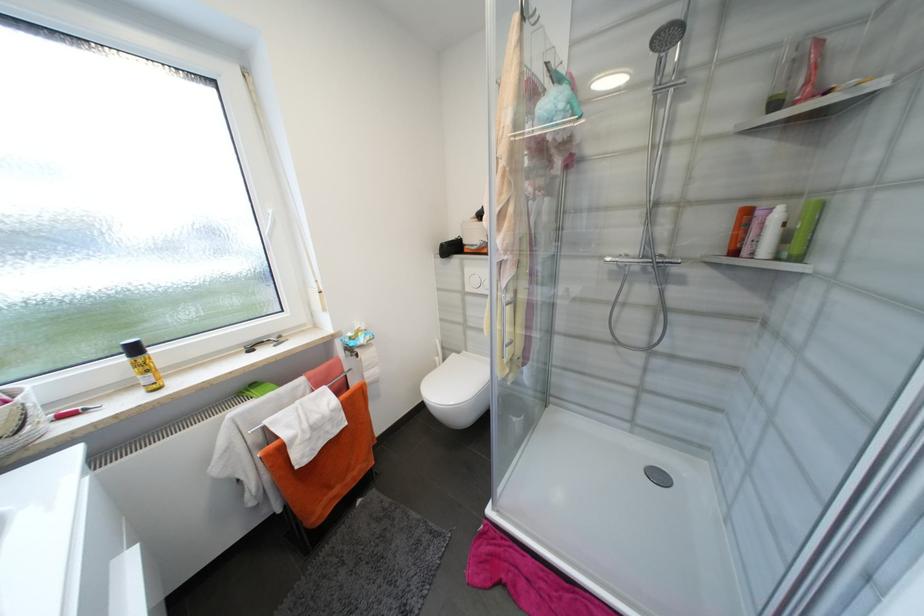
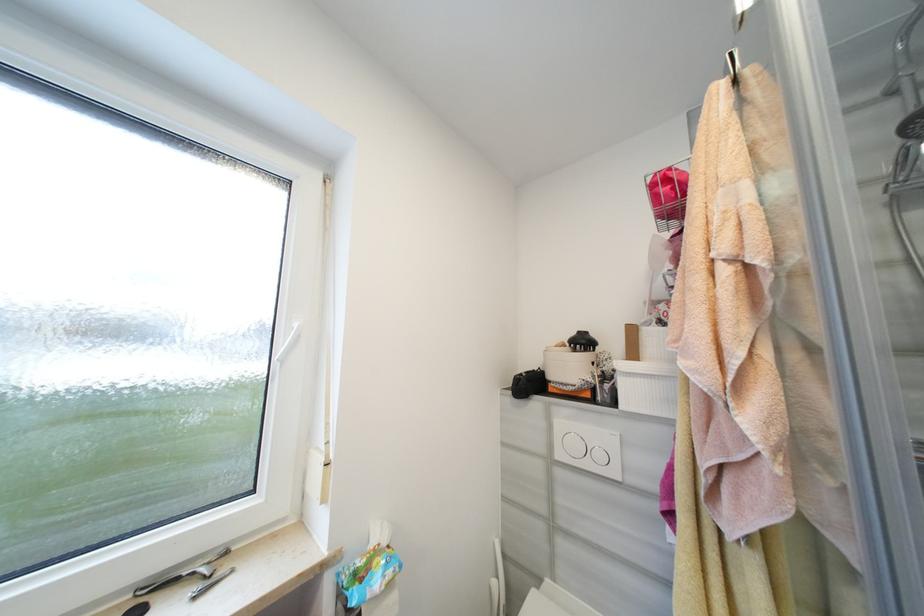
The images are taken continuously from a first-person perspective. In which direction are you moving?

→ The cameraman walked toward left, forward.